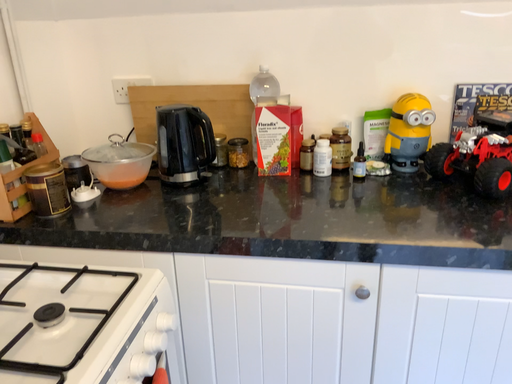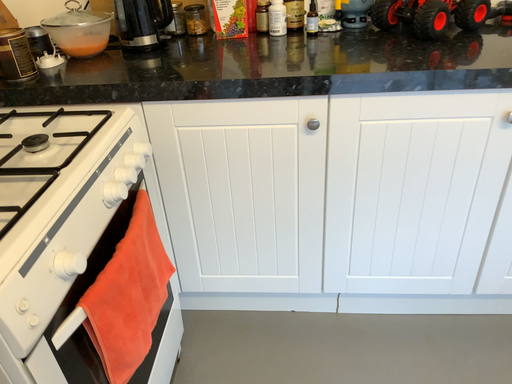
Question: How did the camera likely rotate when shooting the video?

Choices:
 (A) rotated downward
 (B) rotated upward

Answer: (A)